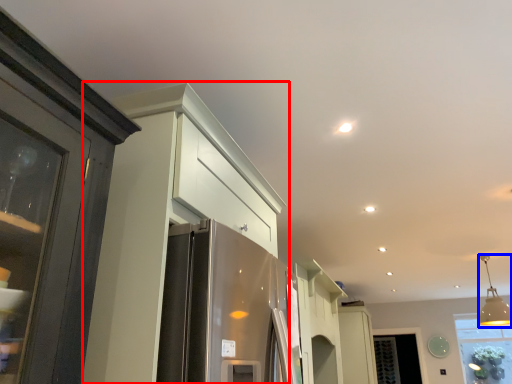
Question: Among these objects, which one is farthest to the camera, cabinetry (highlighted by a red box) or light fixture (highlighted by a blue box)?

Choices:
 (A) cabinetry
 (B) light fixture

Answer: (B)